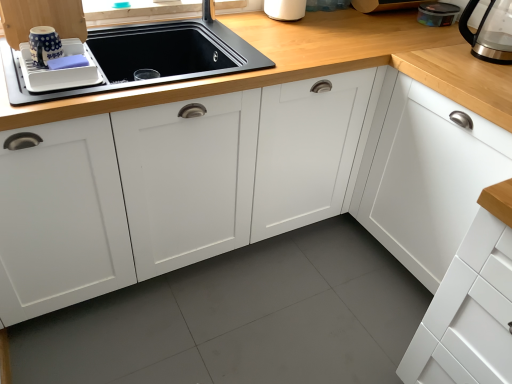
You are a GUI agent. You are given a task and a screenshot of the screen. Output one action in this format:
    pyautogui.click(x=<x>, y=<y>)
    Task: Click on the vacant space that is to the left of transparent glass coffeepot at upper right
    The height and width of the screenshot is (384, 512).
    Given the screenshot: What is the action you would take?
    pyautogui.click(x=443, y=52)